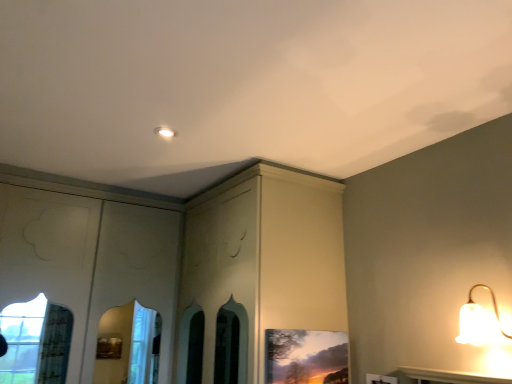
Question: Is white frosted glass lamp at upper right far from matte wooden picture frame at lower center?

Choices:
 (A) yes
 (B) no

Answer: (B)

Question: Is white frosted glass lamp at upper right closer to camera compared to matte wooden picture frame at lower center?

Choices:
 (A) no
 (B) yes

Answer: (B)

Question: Could matte wooden picture frame at lower center be considered to be inside white frosted glass lamp at upper right?

Choices:
 (A) no
 (B) yes

Answer: (A)

Question: Is white frosted glass lamp at upper right completely or partially outside of matte wooden picture frame at lower center?

Choices:
 (A) yes
 (B) no

Answer: (A)

Question: Can you confirm if white frosted glass lamp at upper right is smaller than matte wooden picture frame at lower center?

Choices:
 (A) yes
 (B) no

Answer: (B)

Question: Is white frosted glass lamp at upper right positioned behind matte wooden picture frame at lower center?

Choices:
 (A) no
 (B) yes

Answer: (A)

Question: Is matte wooden picture frame at lower center far from white frosted glass lamp at upper right?

Choices:
 (A) yes
 (B) no

Answer: (B)

Question: Is matte wooden picture frame at lower center oriented towards white frosted glass lamp at upper right?

Choices:
 (A) yes
 (B) no

Answer: (A)

Question: Can you confirm if matte wooden picture frame at lower center is smaller than white frosted glass lamp at upper right?

Choices:
 (A) yes
 (B) no

Answer: (A)

Question: Does matte wooden picture frame at lower center have a greater height compared to white frosted glass lamp at upper right?

Choices:
 (A) yes
 (B) no

Answer: (A)

Question: Is matte wooden picture frame at lower center in contact with white frosted glass lamp at upper right?

Choices:
 (A) no
 (B) yes

Answer: (A)

Question: Does matte wooden picture frame at lower center have a lesser height compared to white frosted glass lamp at upper right?

Choices:
 (A) yes
 (B) no

Answer: (B)

Question: Choose the correct answer: Is matte wooden picture frame at lower center inside white frosted glass lamp at upper right or outside it?

Choices:
 (A) outside
 (B) inside

Answer: (A)